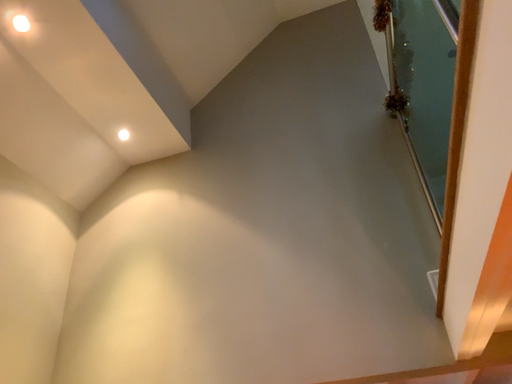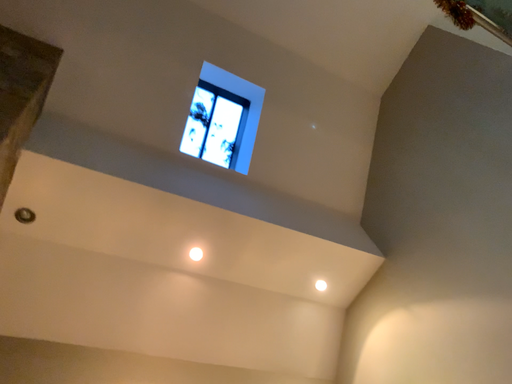
Question: Which way did the camera rotate in the video?

Choices:
 (A) rotated downward
 (B) rotated upward

Answer: (B)